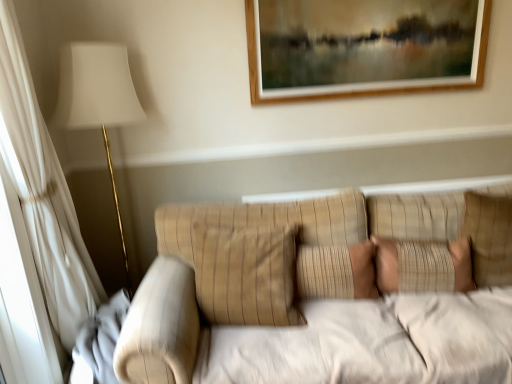
Question: Is beige striped pillow at center, positioned as the third pillow in right-to-left order, at the right side of beige textured pillow at center, which is counted as the 2th pillow, starting from the right?

Choices:
 (A) yes
 (B) no

Answer: (B)

Question: From the image's perspective, is beige striped pillow at center, positioned as the third pillow in right-to-left order, beneath beige textured pillow at center, arranged as the second pillow when viewed from the left?

Choices:
 (A) no
 (B) yes

Answer: (A)

Question: Is beige striped pillow at center, positioned as the third pillow in right-to-left order, shorter than beige textured pillow at center, arranged as the second pillow when viewed from the left?

Choices:
 (A) no
 (B) yes

Answer: (A)

Question: Is beige striped pillow at center, positioned as the third pillow in right-to-left order, taller than beige textured pillow at center, arranged as the second pillow when viewed from the left?

Choices:
 (A) yes
 (B) no

Answer: (A)

Question: Is beige textured pillow at center, arranged as the second pillow when viewed from the left, inside beige striped pillow at center, positioned as the third pillow in right-to-left order?

Choices:
 (A) yes
 (B) no

Answer: (B)

Question: Is beige striped pillow at center, positioned as the third pillow in right-to-left order, facing towards beige textured pillow at center, which is counted as the 2th pillow, starting from the right?

Choices:
 (A) yes
 (B) no

Answer: (B)

Question: From the image's perspective, is beige textured pillow at right, acting as the 3th pillow starting from the left, on top of beige textured pillow at center, arranged as the second pillow when viewed from the left?

Choices:
 (A) no
 (B) yes

Answer: (B)

Question: Is beige textured pillow at right, which is counted as the 1th pillow, starting from the right, positioned behind beige textured pillow at center, arranged as the second pillow when viewed from the left?

Choices:
 (A) yes
 (B) no

Answer: (A)

Question: Is beige textured pillow at right, acting as the 3th pillow starting from the left, closer to the viewer compared to beige textured pillow at center, arranged as the second pillow when viewed from the left?

Choices:
 (A) yes
 (B) no

Answer: (B)

Question: Does beige textured pillow at right, acting as the 3th pillow starting from the left, appear on the right side of beige textured pillow at center, arranged as the second pillow when viewed from the left?

Choices:
 (A) yes
 (B) no

Answer: (A)

Question: Does beige textured pillow at right, which is counted as the 1th pillow, starting from the right, have a lesser width compared to beige textured pillow at center, which is counted as the 2th pillow, starting from the right?

Choices:
 (A) yes
 (B) no

Answer: (B)

Question: From a real-world perspective, does beige textured pillow at right, which is counted as the 1th pillow, starting from the right, sit lower than beige textured pillow at center, arranged as the second pillow when viewed from the left?

Choices:
 (A) yes
 (B) no

Answer: (B)

Question: Is beige textured pillow at center, which is counted as the 2th pillow, starting from the right, far away from beige striped pillow at center, positioned as the third pillow in right-to-left order?

Choices:
 (A) no
 (B) yes

Answer: (A)